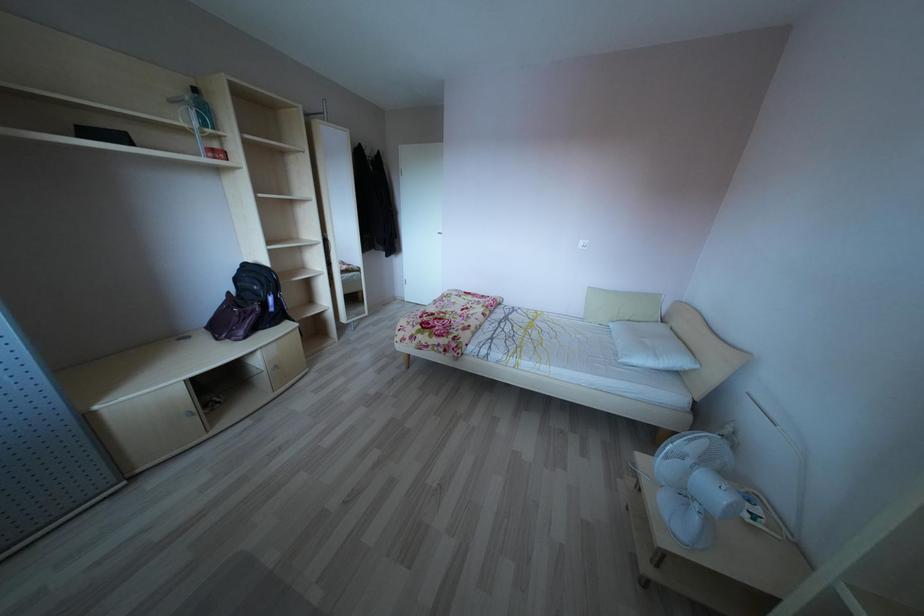
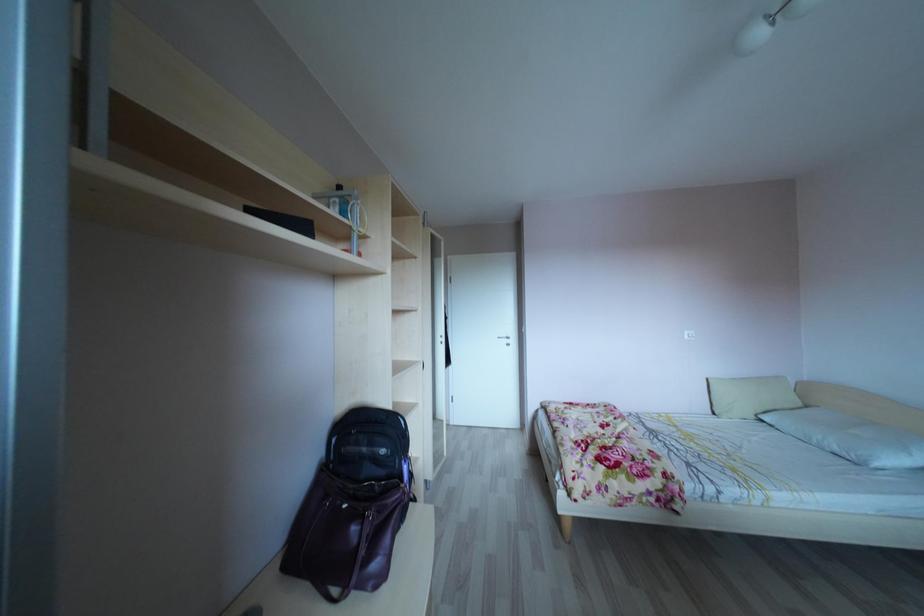
Which direction would the cameraman need to move to produce the second image?

The cameraman moved toward left, forward.